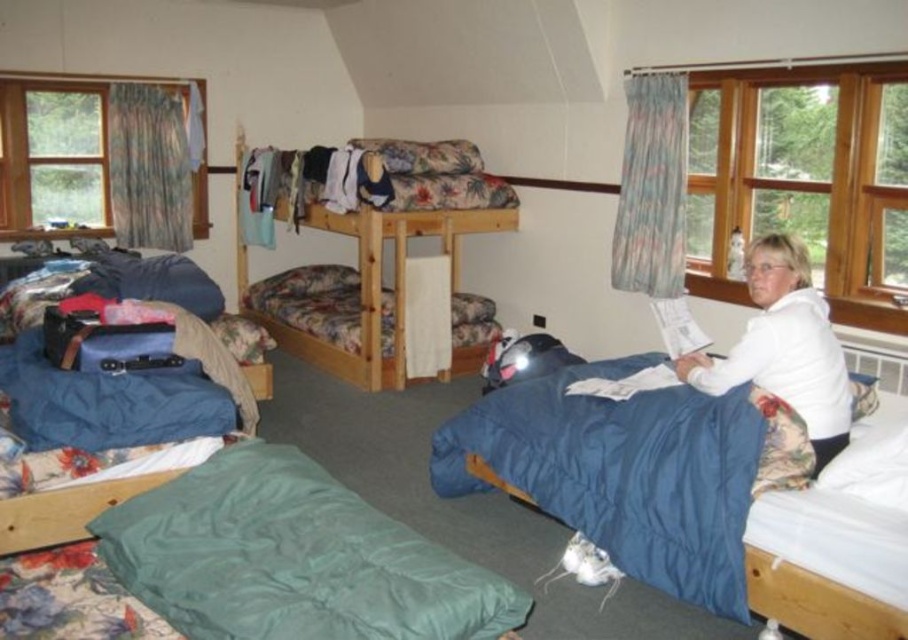
You are standing in the room and want to look outside through the clear glass window at upper right without moving from your spot. Is the floral fabric bunk bed at upper center blocking your view of the window?

The clear glass window at upper right is closer to the viewer than the floral fabric bunk bed at upper center, so the bunk bed is not blocking your view of the window.

You are standing in the room and want to place a small decoration between the two points labeled point (477, 220) and point (204, 164). Which point should you move closer to ensure the decoration is near the front of the room?

You should move the decoration closer to point (477, 220) because it is closer to the viewer than point (204, 164).

You are standing in the room and want to place a new poster on the wall. The poster requires a nail to be placed at point coordinates of 0.439, 0.421. Is this point on the floral fabric bunk bed at upper center?

Yes, the coordinates (x=381, y=280) correspond to the location of the floral fabric bunk bed at upper center, so placing a nail there would hit the bunk bed.